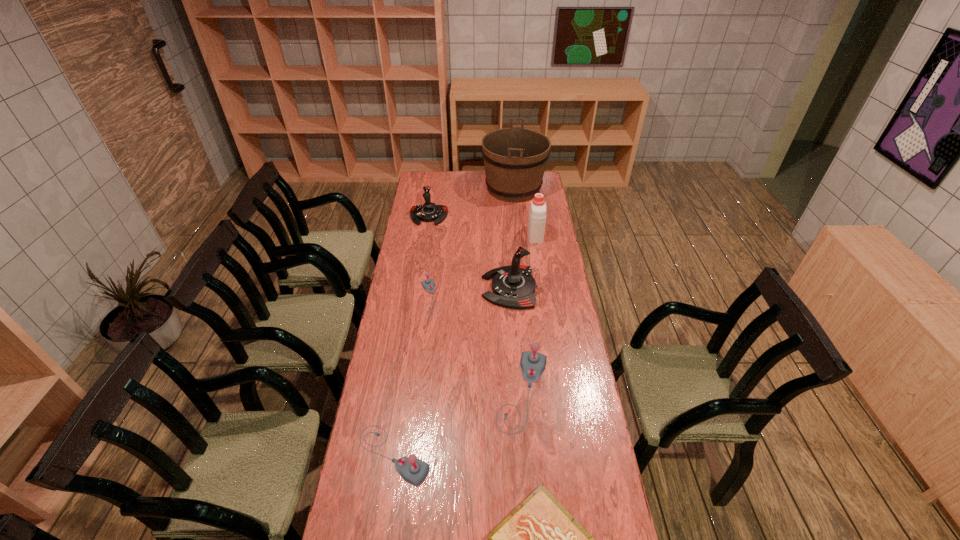
Locate an element on the screen. This screenshot has height=540, width=960. vacant space at the right edge is located at coordinates (555, 258).

You are a GUI agent. You are given a task and a screenshot of the screen. Output one action in this format:
    pyautogui.click(x=<x>, y=<y>)
    Task: Click on the empty space between the farthest object and the farther red joystick
    The image size is (960, 540).
    Given the screenshot: What is the action you would take?
    pyautogui.click(x=471, y=202)

This screenshot has width=960, height=540. I want to click on free spot between the third shortest object and the bigger red joystick, so click(x=451, y=372).

Where is `vacant area that lies between the fourth tallest object and the tallest object`? The width and height of the screenshot is (960, 540). vacant area that lies between the fourth tallest object and the tallest object is located at coordinates (471, 202).

Locate an element on the screen. Image resolution: width=960 pixels, height=540 pixels. vacant area that lies between the sixth tallest object and the nearer red joystick is located at coordinates (451, 372).

Locate an element on the screen. The height and width of the screenshot is (540, 960). free space between the farthest object and the smaller red joystick is located at coordinates (471, 202).

Locate an element on the screen. The height and width of the screenshot is (540, 960). object that stands as the sixth closest to the second shortest joystick is located at coordinates (429, 212).

Select which object is the second closest to the third tallest joystick. Please provide its 2D coordinates. Your answer should be formatted as a tuple, i.e. [(x, y)], where the tuple contains the x and y coordinates of a point satisfying the conditions above.

[(413, 470)]

I want to click on joystick that can be found as the closest to the seventh tallest object, so click(x=513, y=286).

I want to click on joystick that is the nearest to the sixth tallest object, so click(532, 363).